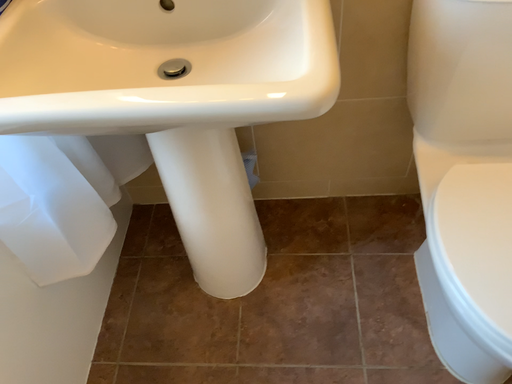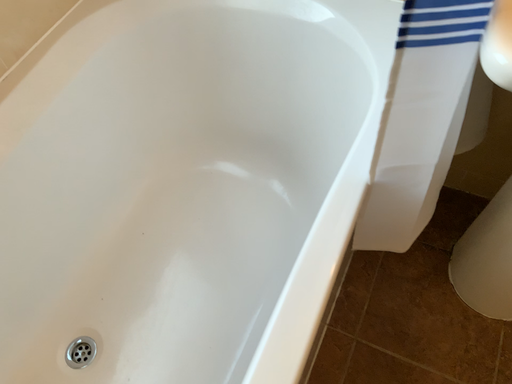
Question: Which way did the camera rotate in the video?

Choices:
 (A) rotated left
 (B) rotated right

Answer: (A)